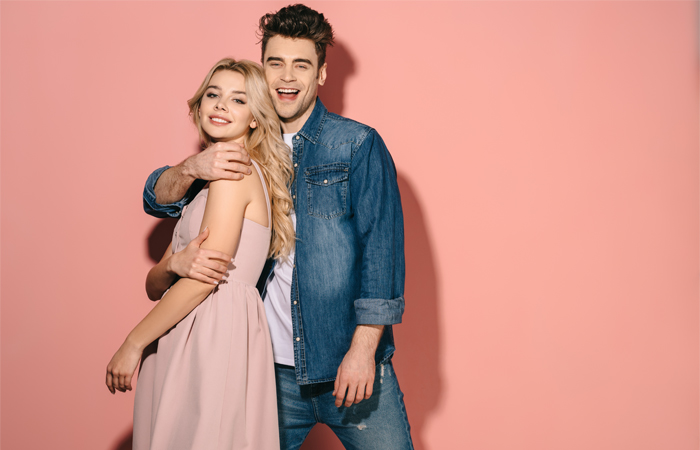
Where is `pink wall`? This screenshot has height=450, width=700. pink wall is located at coordinates (692, 160).